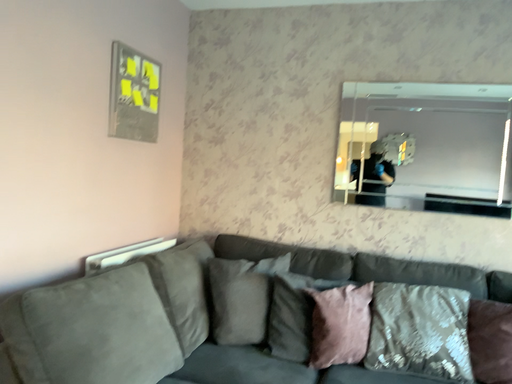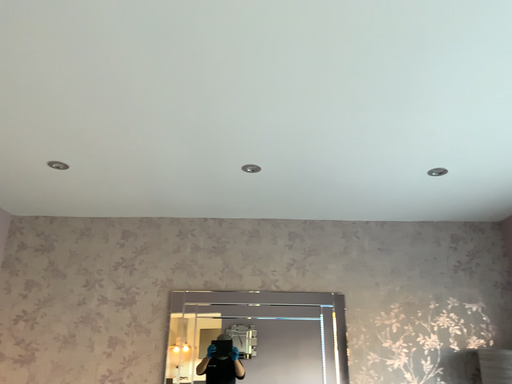
Question: Which way did the camera rotate in the video?

Choices:
 (A) rotated right
 (B) rotated left

Answer: (A)